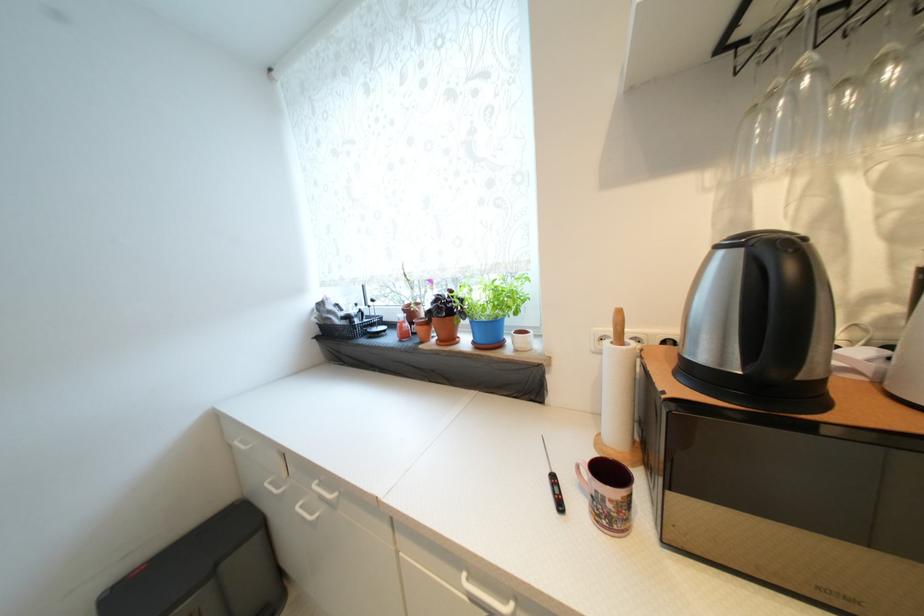
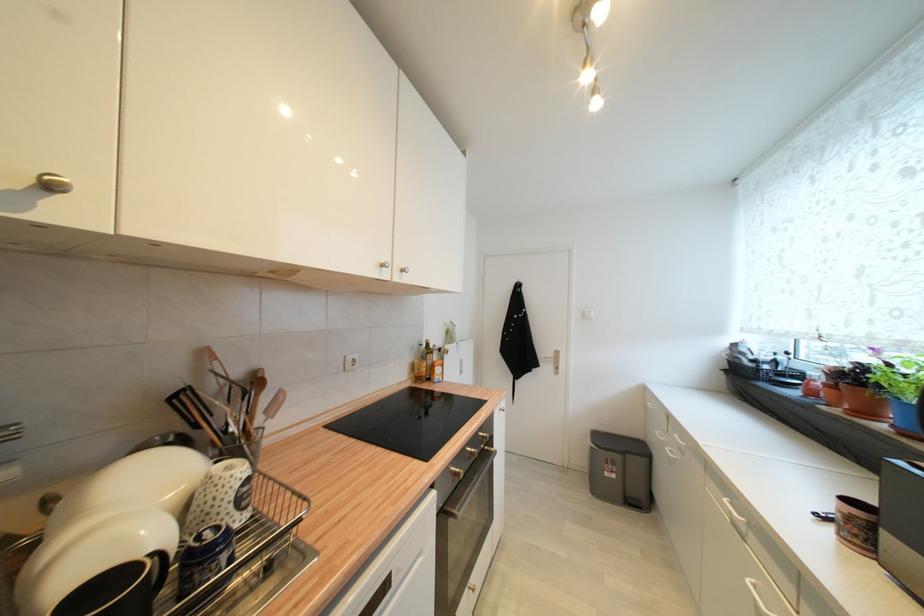
Question: The camera is either moving clockwise (left) or counter-clockwise (right) around the object. The first image is from the beginning of the video and the second image is from the end. Is the camera moving left or right when shooting the video?

Choices:
 (A) Left
 (B) Right

Answer: (B)